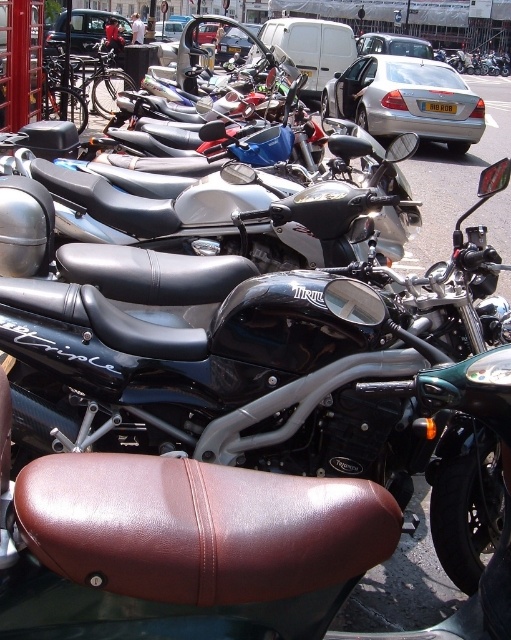
You are a photographer positioned at the front of the street scene. You want to capture a shot that includes both the black leather seat at center and the metallic silver car at center. Based on their positions, which object should you adjust your camera to focus on first to ensure both are in frame?

Since the black leather seat at center is to the right of the metallic silver car at center, you should first focus on the metallic silver car at center and then pan right to include the black leather seat at center in your shot.

You are a pedestrian standing at the edge of the street. You see a metallic silver car at center and a silver metallic sedan at upper center. Which vehicle is nearer to you?

The metallic silver car at center is closer to the viewer than the silver metallic sedan at upper center.

You are a photographer standing in front of the black leather seat at center and the metallic silver car at center. You want to take a photo of both objects in the same frame. Considering their heights, which object will appear smaller in the photo?

The black leather seat at center has a lesser height compared to the metallic silver car at center, so it will appear smaller in the photo.